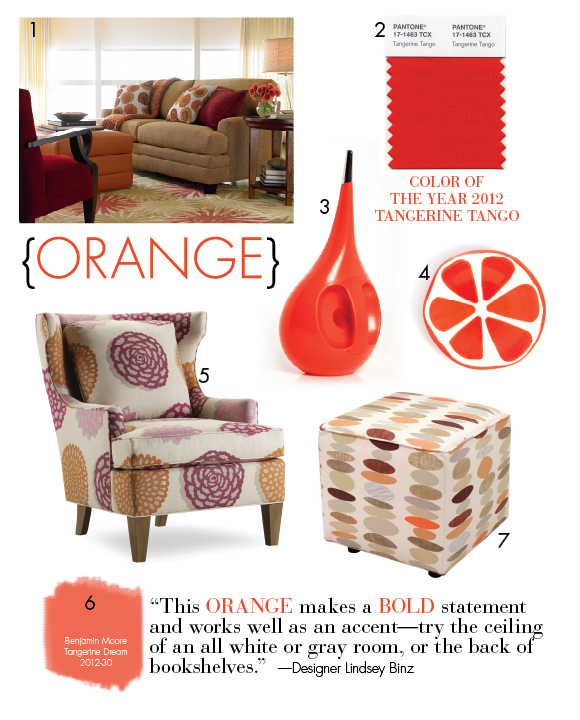
This screenshot has width=580, height=720. Find the location of `couch`. couch is located at coordinates (168, 139).